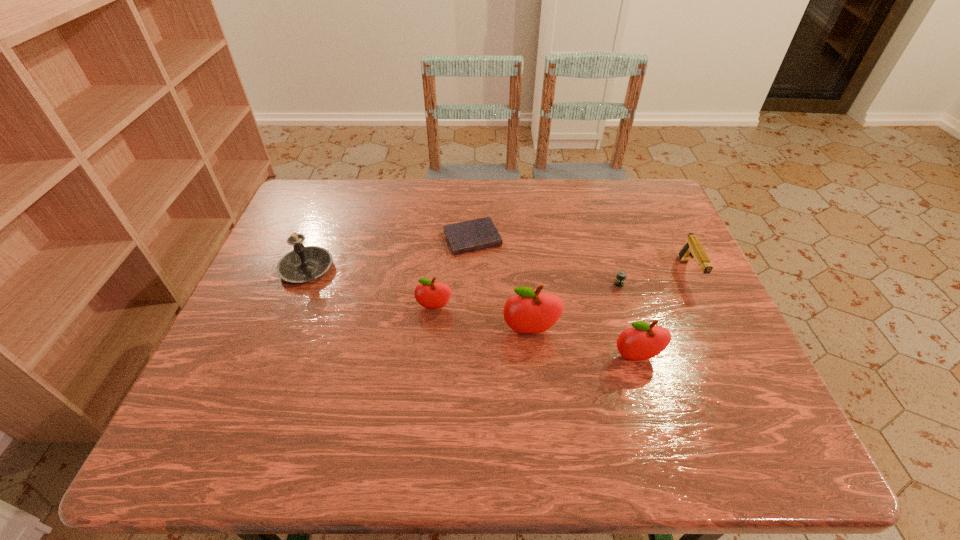
Find the location of `the fifth farthest object`. the fifth farthest object is located at coordinates (428, 294).

This screenshot has height=540, width=960. In order to click on the shortest apple in this screenshot , I will do `click(428, 294)`.

Find the location of a particular element. the sixth farthest object is located at coordinates (529, 311).

Where is `the second farthest apple`? The width and height of the screenshot is (960, 540). the second farthest apple is located at coordinates (529, 311).

I want to click on the nearest object, so click(x=642, y=341).

Image resolution: width=960 pixels, height=540 pixels. I want to click on the rightmost apple, so click(642, 341).

Locate an element on the screen. The height and width of the screenshot is (540, 960). diary is located at coordinates (477, 234).

This screenshot has height=540, width=960. I want to click on the sixth tallest object, so click(621, 276).

Find the location of a particular element. candle is located at coordinates (305, 263).

The width and height of the screenshot is (960, 540). I want to click on the rightmost object, so click(x=692, y=249).